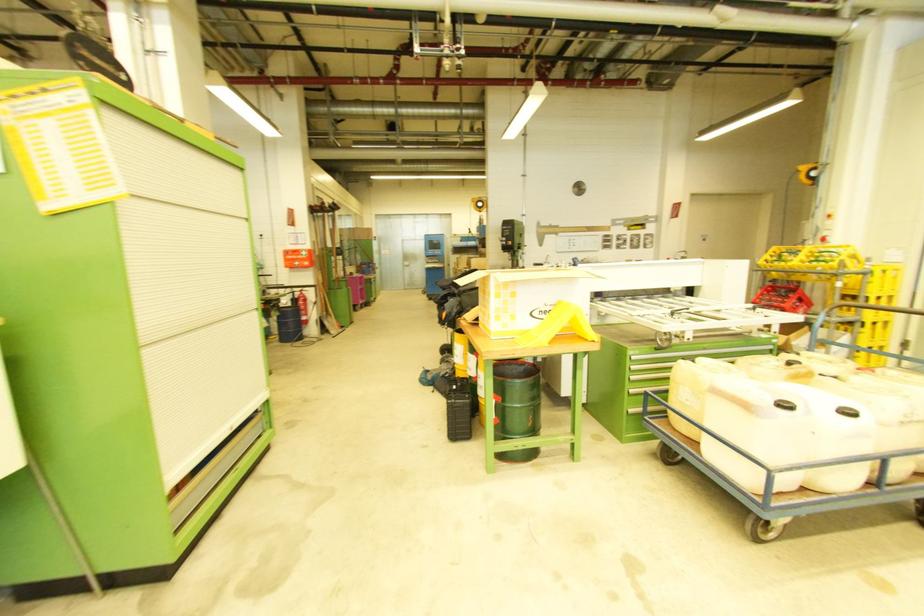
Where is `blue cart handle`? Image resolution: width=924 pixels, height=616 pixels. blue cart handle is located at coordinates (688, 440).